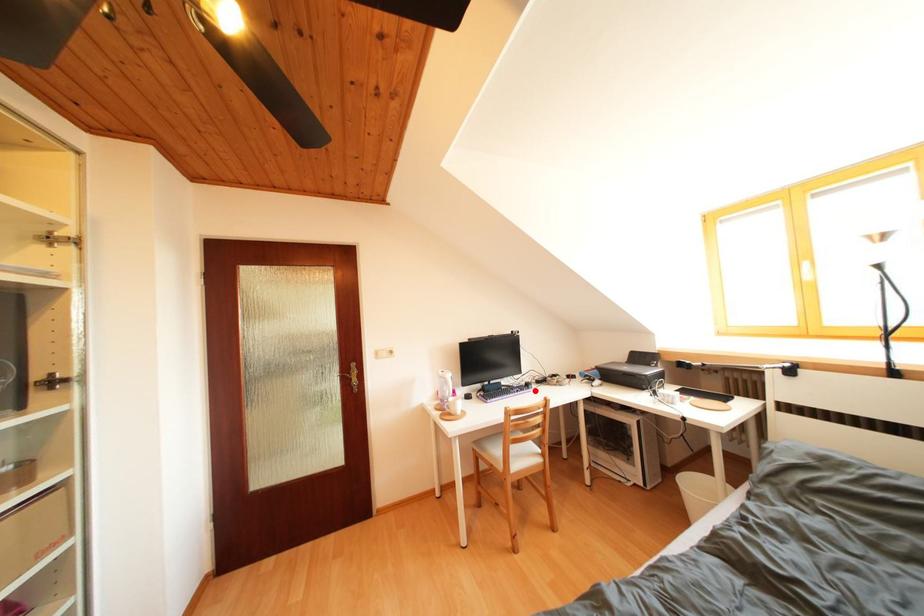
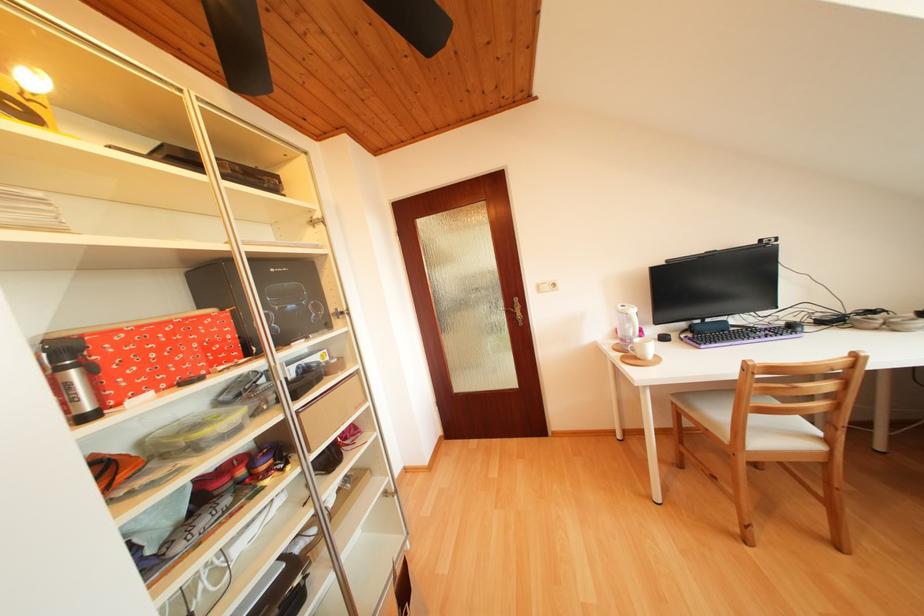
Question: I am providing you with two images of the same scene from different viewpoints. A red point is shown in image1. For the corresponding object point in image2, is it positioned nearer or farther from the camera?

Choices:
 (A) Nearer
 (B) Farther

Answer: (A)